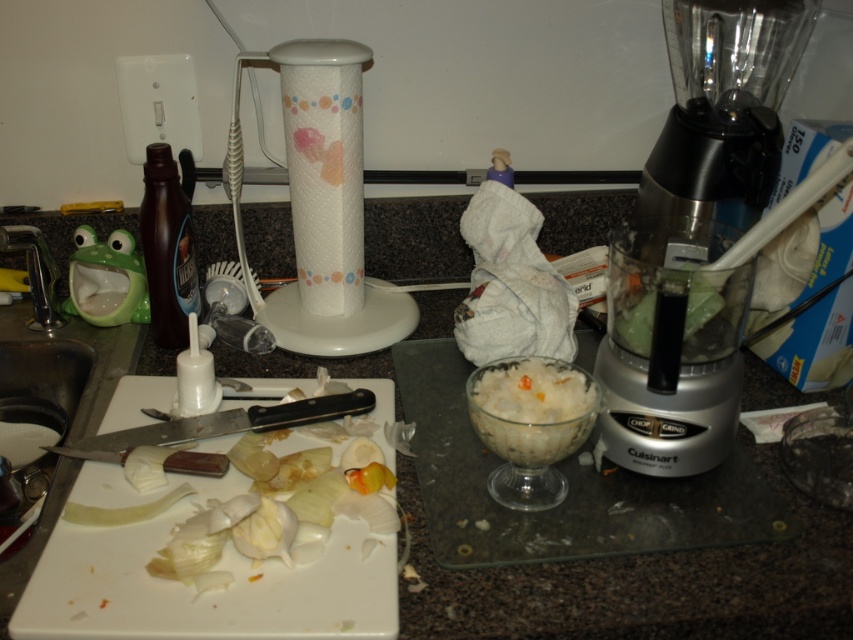
You are organizing the kitchen and need to place a new spice rack between the granite gray counter top at center and the white glossy paper towel holder at center. Based on their positions, which object should the spice rack be placed closer to?

The spice rack should be placed closer to the white glossy paper towel holder at center because the granite gray counter top at center is to the right of it, meaning the paper towel holder is on the left side.

You are a chef preparing a dish and need to place the white glossy paper towel holder at center and the white translucent bowl at center on the same shelf. If the shelf has limited vertical space, which item might not fit due to its height?

The white glossy paper towel holder at center is much taller than the white translucent bowl at center, so it might not fit on the shelf with limited vertical space.

You are a delivery robot with a 24 inch wide package. You need to place it on the kitchen countertop shown in the image. The only available space is at point (566,630). Can you fit the package there?

The point at (566,630) is 23.54 inches from the camera. Since the package is 24 inches wide, it will not fit as the space is slightly narrower.